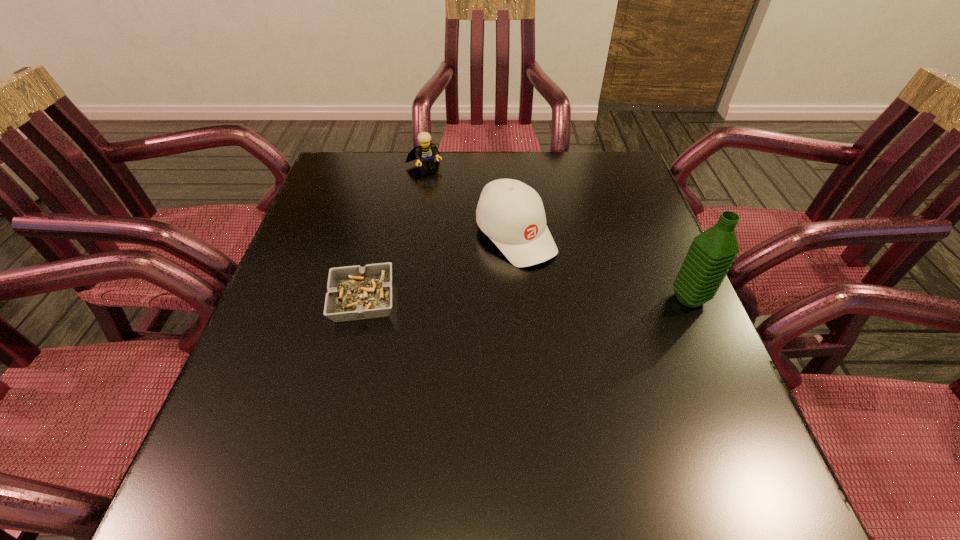
The height and width of the screenshot is (540, 960). Find the location of `vacant space at the right edge of the desktop`. vacant space at the right edge of the desktop is located at coordinates (632, 263).

Where is `vacant region at the far left corner`? vacant region at the far left corner is located at coordinates (360, 198).

Find the location of `vacant space at the near left corner of the desktop`. vacant space at the near left corner of the desktop is located at coordinates (225, 423).

At what (x,y) coordinates should I click in order to perform the action: click on blank space at the far right corner of the desktop. Please return your answer as a coordinate pair (x, y). This screenshot has height=540, width=960. Looking at the image, I should click on (589, 156).

This screenshot has height=540, width=960. Find the location of `vacant area that lies between the farthest object and the tallest object`. vacant area that lies between the farthest object and the tallest object is located at coordinates (557, 232).

This screenshot has height=540, width=960. Find the location of `free space between the second object from right to left and the farthest object`. free space between the second object from right to left and the farthest object is located at coordinates (469, 201).

At what (x,y) coordinates should I click in order to perform the action: click on vacant region between the ashtray and the third nearest object. Please return your answer as a coordinate pair (x, y). The image size is (960, 540). Looking at the image, I should click on click(440, 268).

What are the coordinates of `vacant point located between the farthest object and the tallest object` in the screenshot? It's located at (557, 232).

You are a GUI agent. You are given a task and a screenshot of the screen. Output one action in this format:
    pyautogui.click(x=<x>, y=<y>)
    Task: Click on the free space between the shortest object and the second object from right to left
    
    Given the screenshot: What is the action you would take?
    pyautogui.click(x=440, y=268)

At what (x,y) coordinates should I click in order to perform the action: click on vacant area that lies between the ashtray and the Lego. Please return your answer as a coordinate pair (x, y). Looking at the image, I should click on (394, 233).